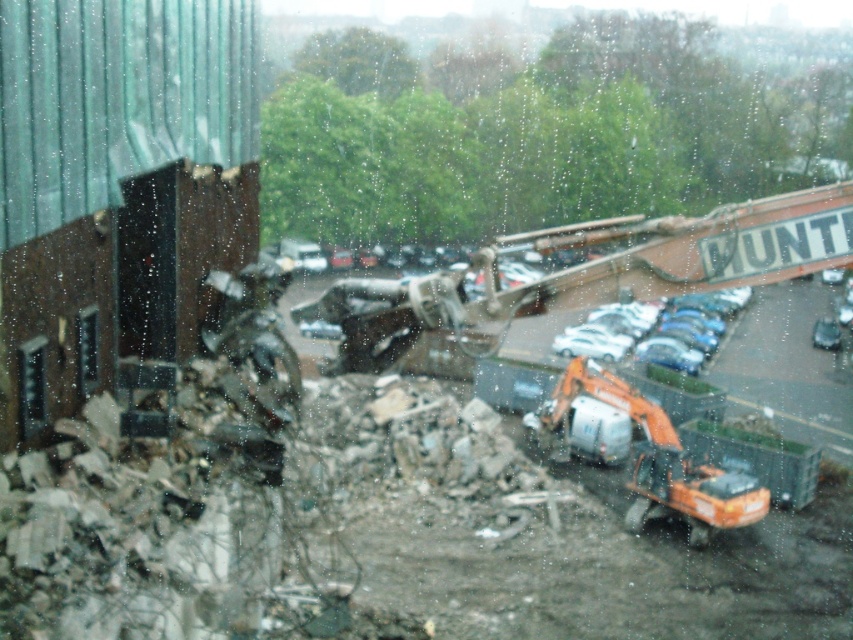
Question: Estimate the real-world distances between objects in this image. Which object is farther from the orange metallic excavator at lower right?

Choices:
 (A) shiny silver car at center
 (B) orange metallic excavator at center

Answer: (A)

Question: Considering the real-world distances, which object is farthest from the orange metallic excavator at lower right?

Choices:
 (A) orange metallic excavator at center
 (B) shiny silver car at center

Answer: (B)

Question: Is orange metallic excavator at center further to the viewer compared to orange metallic excavator at lower right?

Choices:
 (A) no
 (B) yes

Answer: (A)

Question: Which object is closer to the camera taking this photo?

Choices:
 (A) orange metallic excavator at lower right
 (B) orange metallic excavator at center

Answer: (B)

Question: Can you confirm if orange metallic excavator at lower right is positioned above shiny silver car at center?

Choices:
 (A) yes
 (B) no

Answer: (B)

Question: From the image, what is the correct spatial relationship of orange metallic excavator at lower right in relation to shiny silver car at center?

Choices:
 (A) below
 (B) above

Answer: (A)